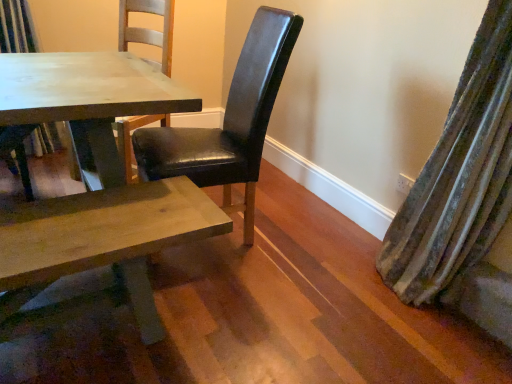
Question: Considering the relative positions of matte wooden table at center and black leather chair at center, which is the 1th chair from front to back, in the image provided, is matte wooden table at center to the right of black leather chair at center, which is the 1th chair from front to back, from the viewer's perspective?

Choices:
 (A) yes
 (B) no

Answer: (B)

Question: Considering the relative sizes of matte wooden table at center and black leather chair at center, arranged as the second chair when viewed from the left, in the image provided, is matte wooden table at center wider than black leather chair at center, arranged as the second chair when viewed from the left,?

Choices:
 (A) yes
 (B) no

Answer: (B)

Question: Does matte wooden table at center have a lesser width compared to black leather chair at center, which is the 1th chair from front to back?

Choices:
 (A) no
 (B) yes

Answer: (B)

Question: Would you say matte wooden table at center is a long distance from black leather chair at center, arranged as the second chair when viewed from the left?

Choices:
 (A) no
 (B) yes

Answer: (A)

Question: Is matte wooden table at center next to black leather chair at center, which is counted as the 2th chair, starting from the back, and touching it?

Choices:
 (A) no
 (B) yes

Answer: (A)

Question: From a real-world perspective, relative to black leather chair at center, which is counted as the 2th chair, starting from the back, is matte wooden table at center vertically above or below?

Choices:
 (A) below
 (B) above

Answer: (A)

Question: From the image's perspective, is matte wooden table at center above or below black leather chair at center, the 1th chair viewed from the right?

Choices:
 (A) below
 (B) above

Answer: (B)

Question: Considering the positions of point (116, 157) and point (160, 170), is point (116, 157) closer or farther from the camera than point (160, 170)?

Choices:
 (A) farther
 (B) closer

Answer: (A)

Question: From their relative heights in the image, would you say matte wooden table at center is taller or shorter than black leather chair at center, which is counted as the 2th chair, starting from the back?

Choices:
 (A) tall
 (B) short

Answer: (B)

Question: Is point (222, 180) positioned closer to the camera than point (501, 180)?

Choices:
 (A) farther
 (B) closer

Answer: (A)

Question: Is black leather chair at center, the 1th chair viewed from the right, in front of or behind velvet green curtain at right in the image?

Choices:
 (A) front
 (B) behind

Answer: (B)

Question: In terms of height, does black leather chair at center, arranged as the second chair when viewed from the left, look taller or shorter compared to velvet green curtain at right?

Choices:
 (A) tall
 (B) short

Answer: (B)

Question: From the image's perspective, is black leather chair at center, which is counted as the 2th chair, starting from the back, located above or below velvet green curtain at right?

Choices:
 (A) below
 (B) above

Answer: (B)

Question: Is point [x=11, y=157] closer or farther from the camera than point [x=280, y=43]?

Choices:
 (A) farther
 (B) closer

Answer: (A)

Question: Looking at the image, does matte black chair at center, positioned as the 1th chair in back-to-front order, seem bigger or smaller compared to black leather chair at center, the 1th chair viewed from the right?

Choices:
 (A) small
 (B) big

Answer: (A)